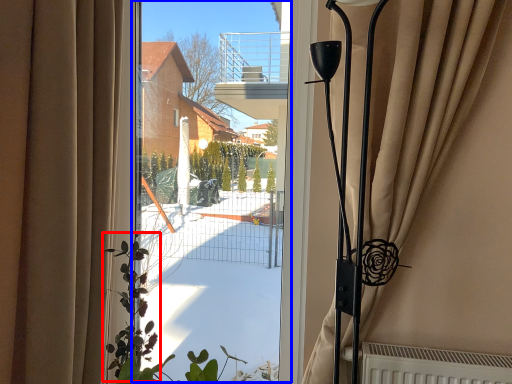
Question: Which object is closer to the camera taking this photo, plant (highlighted by a red box) or window screen (highlighted by a blue box)?

Choices:
 (A) plant
 (B) window screen

Answer: (A)